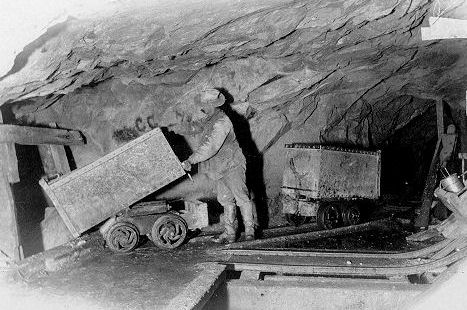
The height and width of the screenshot is (310, 467). Identify the location of paint. (140, 124).